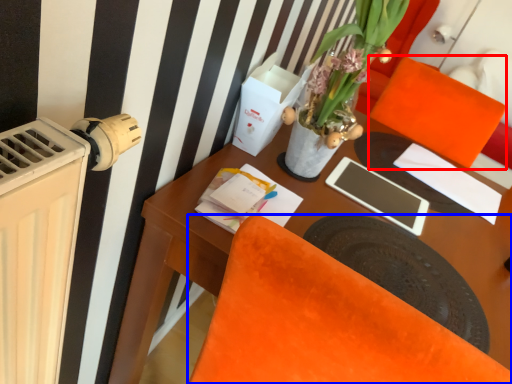
Question: Which object appears closest to the camera in this image, armchair (highlighted by a red box) or chair (highlighted by a blue box)?

Choices:
 (A) armchair
 (B) chair

Answer: (B)